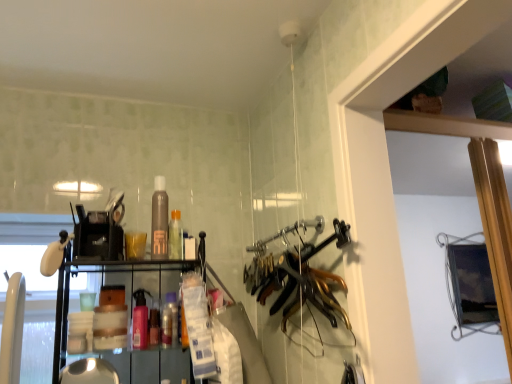
Question: Is pink matte spray bottle at center, which ranks as the 2th bottle in bottom-to-top order, closer to camera compared to brown matte bottle at center, the 4th bottle when ordered from bottom to top?

Choices:
 (A) yes
 (B) no

Answer: (A)

Question: Does pink matte spray bottle at center, which ranks as the 2th bottle in bottom-to-top order, turn towards brown matte bottle at center, which appears as the 1th bottle when viewed from the top?

Choices:
 (A) yes
 (B) no

Answer: (B)

Question: Is pink matte spray bottle at center, arranged as the third bottle when viewed from the top, outside brown matte bottle at center, the 4th bottle when ordered from bottom to top?

Choices:
 (A) yes
 (B) no

Answer: (A)

Question: Is pink matte spray bottle at center, arranged as the third bottle when viewed from the top, far from brown matte bottle at center, the 4th bottle when ordered from bottom to top?

Choices:
 (A) yes
 (B) no

Answer: (B)

Question: From the image's perspective, is pink matte spray bottle at center, arranged as the third bottle when viewed from the top, on brown matte bottle at center, the 4th bottle when ordered from bottom to top?

Choices:
 (A) no
 (B) yes

Answer: (A)

Question: Considering the positions of point (163, 311) and point (289, 274), is point (163, 311) closer or farther from the camera than point (289, 274)?

Choices:
 (A) farther
 (B) closer

Answer: (A)

Question: In the image, is translucent plastic bottle at center, positioned as the first bottle in bottom-to-top order, positioned in front of or behind gold metallic hangers at center?

Choices:
 (A) behind
 (B) front

Answer: (A)

Question: Considering the relative positions of translucent plastic bottle at center, positioned as the first bottle in bottom-to-top order, and gold metallic hangers at center in the image provided, is translucent plastic bottle at center, positioned as the first bottle in bottom-to-top order, to the left or to the right of gold metallic hangers at center?

Choices:
 (A) right
 (B) left

Answer: (B)

Question: Is translucent plastic bottle at center, positioned as the first bottle in bottom-to-top order, inside or outside of gold metallic hangers at center?

Choices:
 (A) outside
 (B) inside

Answer: (A)

Question: From a real-world perspective, is pink matte spray bottle at center, arranged as the third bottle when viewed from the top, positioned above or below gold metallic hangers at center?

Choices:
 (A) above
 (B) below

Answer: (B)

Question: Is point (143, 307) closer or farther from the camera than point (303, 289)?

Choices:
 (A) farther
 (B) closer

Answer: (A)

Question: Considering the positions of pink matte spray bottle at center, arranged as the third bottle when viewed from the top, and gold metallic hangers at center in the image, is pink matte spray bottle at center, arranged as the third bottle when viewed from the top, bigger or smaller than gold metallic hangers at center?

Choices:
 (A) small
 (B) big

Answer: (A)

Question: From the image's perspective, is pink matte spray bottle at center, which ranks as the 2th bottle in bottom-to-top order, located above or below gold metallic hangers at center?

Choices:
 (A) below
 (B) above

Answer: (A)

Question: Is point (329, 294) positioned closer to the camera than point (158, 230)?

Choices:
 (A) closer
 (B) farther

Answer: (A)

Question: From the image's perspective, is gold metallic hangers at center positioned above or below brown matte bottle at center, the 4th bottle when ordered from bottom to top?

Choices:
 (A) above
 (B) below

Answer: (B)